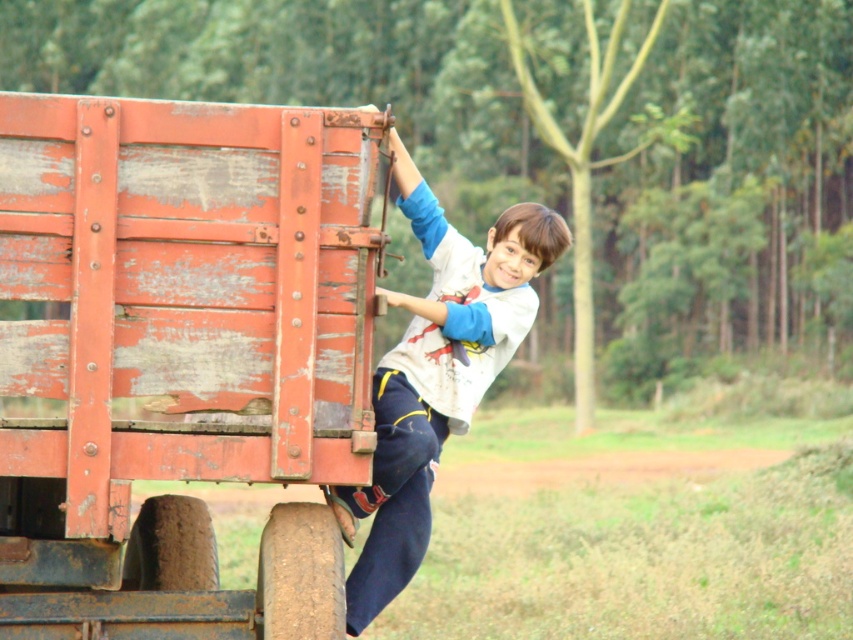
You are a photographer trying to capture the boy in the white cotton shirt at center without the rusty wood wagon at left blocking the view. Is the wagon currently blocking the photographer from seeing the boy?

The rusty wood wagon at left is in front of the white cotton shirt at center, so it is blocking the photographer from seeing the boy.

You are a photographer trying to capture both the rusty wood wagon at left and the white cotton shirt at center in a single shot. Since the camera can only focus on one object at a time, which object should you choose to ensure the larger one is in focus?

The rusty wood wagon at left is larger than the white cotton shirt at center, so you should focus on the rusty wood wagon at left to ensure the larger object is in focus.